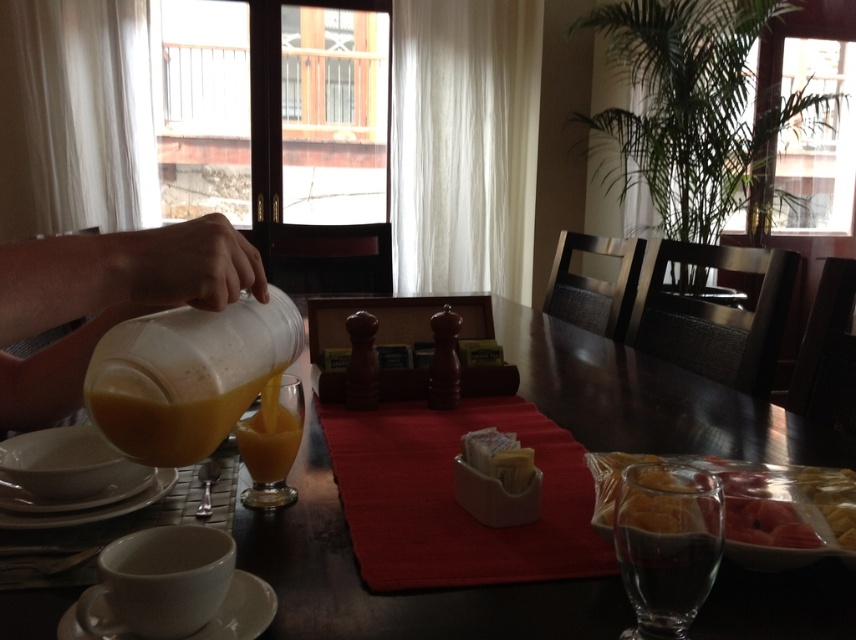
Looking at this image, you are arranging items on a dining table for a breakfast setup. You have a translucent plastic bag at lower right and a white matte plate at lower left. Which item is positioned higher up on the table?

The translucent plastic bag at lower right is located above the white matte plate at lower left, so it is positioned higher up on the table.

You are setting up a table for a breakfast buffet and need to place a decorative centerpiece that requires at least 12 inches of space. Given the translucent glass at center and the yellow matte sugar packets at center, which item should you move to accommodate the centerpiece?

The translucent glass at center might be wider than yellow matte sugar packets at center, so you should move the translucent glass at center to make space for the centerpiece.